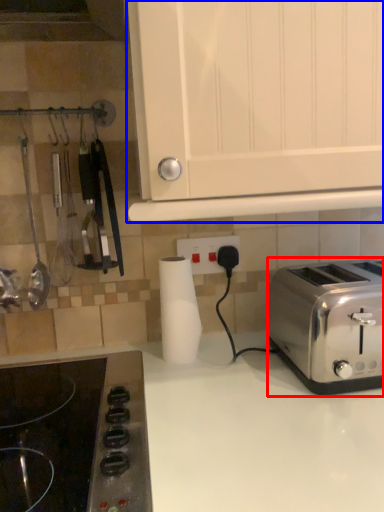
Question: Which point is closer to the camera, toaster (highlighted by a red box) or cabinetry (highlighted by a blue box)?

Choices:
 (A) toaster
 (B) cabinetry

Answer: (B)